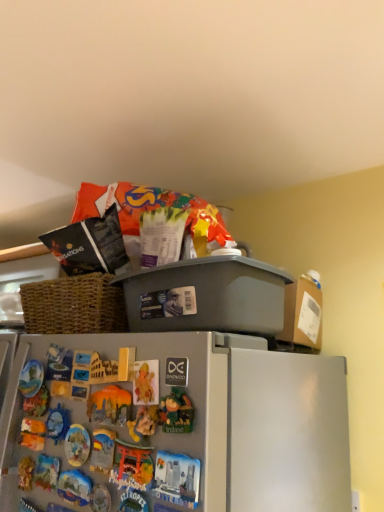
Where is `matte plastic toy at center`? The image size is (384, 512). matte plastic toy at center is located at coordinates (109, 406).

Describe the element at coordinates (109, 406) in the screenshot. The width and height of the screenshot is (384, 512). I see `matte plastic toy at center` at that location.

Describe the element at coordinates (206, 296) in the screenshot. I see `gray plastic bin at upper center` at that location.

The image size is (384, 512). What are the coordinates of `gray plastic bin at upper center` in the screenshot? It's located at (206, 296).

In order to face gray plastic bin at upper center, should I rotate leftwards or rightwards?

Turn right approximately 0.423 degrees to face it.

Where is `matte plastic toy at center`? The height and width of the screenshot is (512, 384). matte plastic toy at center is located at coordinates (109, 406).

Which is more to the left, matte plastic toy at center or gray plastic bin at upper center?

matte plastic toy at center.

Who is more distant, matte plastic toy at center or gray plastic bin at upper center?

Positioned behind is gray plastic bin at upper center.

Does point (106, 418) lie in front of point (265, 291)?

That is True.

Consider the image. From the image's perspective, relative to gray plastic bin at upper center, is matte plastic toy at center above or below?

matte plastic toy at center is below gray plastic bin at upper center.

From a real-world perspective, relative to gray plastic bin at upper center, is matte plastic toy at center vertically above or below?

In terms of real-world spatial position, matte plastic toy at center is below gray plastic bin at upper center.

Considering the relative sizes of matte plastic toy at center and gray plastic bin at upper center in the image provided, is matte plastic toy at center wider than gray plastic bin at upper center?

In fact, matte plastic toy at center might be narrower than gray plastic bin at upper center.

Is matte plastic toy at center taller or shorter than gray plastic bin at upper center?

Clearly, matte plastic toy at center is shorter compared to gray plastic bin at upper center.

Does matte plastic toy at center have a larger size compared to gray plastic bin at upper center?

Actually, matte plastic toy at center might be smaller than gray plastic bin at upper center.

Is matte plastic toy at center inside the boundaries of gray plastic bin at upper center, or outside?

A: matte plastic toy at center is not inside gray plastic bin at upper center, it's outside.

Are matte plastic toy at center and gray plastic bin at upper center beside each other?

No.

Is matte plastic toy at center facing away from gray plastic bin at upper center?

That's not correct — matte plastic toy at center is not looking away from gray plastic bin at upper center.

How far apart are matte plastic toy at center and gray plastic bin at upper center?

matte plastic toy at center and gray plastic bin at upper center are 8.69 inches apart.

Identify the location of toy in front of the gray plastic bin at upper center. The height and width of the screenshot is (512, 384). (109, 406).

Is gray plastic bin at upper center to the right of matte plastic toy at center from the viewer's perspective?

Yes, gray plastic bin at upper center is to the right of matte plastic toy at center.

Who is more distant, gray plastic bin at upper center or matte plastic toy at center?

gray plastic bin at upper center.

Which is less distant, (155, 307) or (130, 400)?

Point (155, 307) appears to be farther away from the viewer than point (130, 400).

From the picture: From the image's perspective, is gray plastic bin at upper center above or below matte plastic toy at center?

gray plastic bin at upper center is above matte plastic toy at center.

From a real-world perspective, is gray plastic bin at upper center positioned under matte plastic toy at center based on gravity?

Actually, gray plastic bin at upper center is physically above matte plastic toy at center in the real world.

In terms of width, does gray plastic bin at upper center look wider or thinner when compared to matte plastic toy at center?

Clearly, gray plastic bin at upper center has more width compared to matte plastic toy at center.

Who is taller, gray plastic bin at upper center or matte plastic toy at center?

gray plastic bin at upper center is taller.

Is gray plastic bin at upper center bigger than matte plastic toy at center?

Indeed, gray plastic bin at upper center has a larger size compared to matte plastic toy at center.

Is matte plastic toy at center a part of gray plastic bin at upper center?

That's incorrect, matte plastic toy at center is not inside gray plastic bin at upper center.

Is gray plastic bin at upper center with matte plastic toy at center?

They are not placed beside each other.

Is gray plastic bin at upper center oriented towards matte plastic toy at center?

No.

Image resolution: width=384 pixels, height=512 pixels. What are the coordinates of `toy below the gray plastic bin at upper center (from a real-world perspective)` in the screenshot? It's located at (109, 406).

Identify the location of toy in front of the gray plastic bin at upper center. The height and width of the screenshot is (512, 384). (109, 406).

The height and width of the screenshot is (512, 384). In order to click on toy below the gray plastic bin at upper center (from a real-world perspective) in this screenshot , I will do `click(109, 406)`.